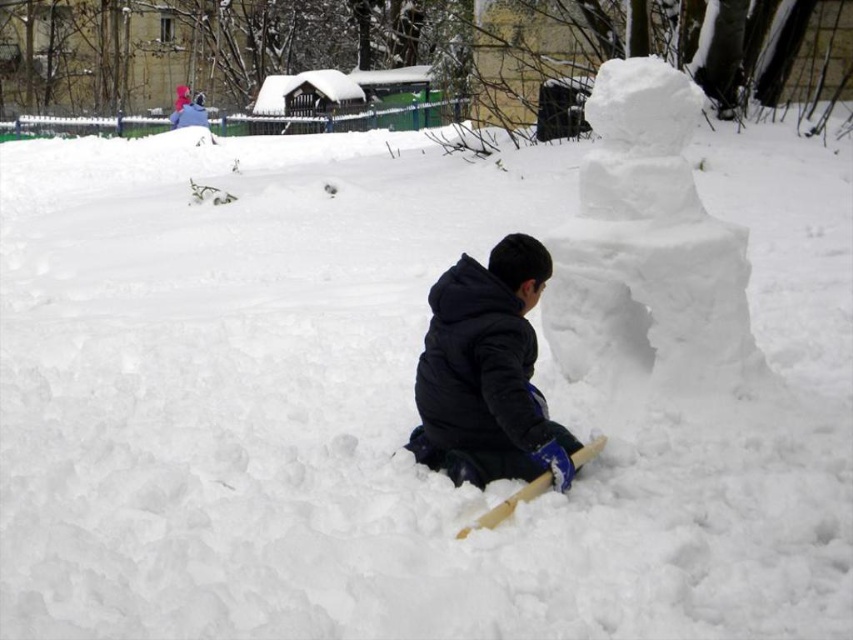
Can you confirm if white fluffy snowman at upper right is wider than black fleece jacket at center?

Correct, the width of white fluffy snowman at upper right exceeds that of black fleece jacket at center.

Which is more to the left, white fluffy snowman at upper right or black fleece jacket at center?

black fleece jacket at center is more to the left.

Locate an element on the screen. white fluffy snowman at upper right is located at coordinates (648, 250).